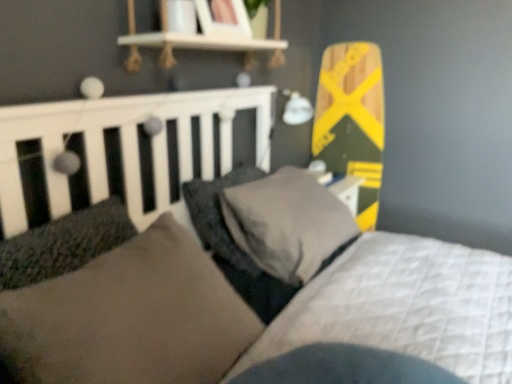
Question: Considering the relative sizes of dark gray plush pillow at center, the second pillow viewed from the back, and suede-like brown pillow at center, the third pillow from the back, in the image provided, is dark gray plush pillow at center, the second pillow viewed from the back, bigger than suede-like brown pillow at center, the third pillow from the back,?

Choices:
 (A) yes
 (B) no

Answer: (B)

Question: Is dark gray plush pillow at center, the second pillow positioned from the front, taller than suede-like brown pillow at center, which is the first pillow in front-to-back order?

Choices:
 (A) no
 (B) yes

Answer: (A)

Question: Is dark gray plush pillow at center, the second pillow viewed from the back, smaller than suede-like brown pillow at center, the third pillow from the back?

Choices:
 (A) yes
 (B) no

Answer: (A)

Question: Is the position of dark gray plush pillow at center, the second pillow viewed from the back, more distant than that of suede-like brown pillow at center, which is the first pillow in front-to-back order?

Choices:
 (A) yes
 (B) no

Answer: (A)

Question: From the image's perspective, is dark gray plush pillow at center, the second pillow positioned from the front, located beneath suede-like brown pillow at center, the third pillow from the back?

Choices:
 (A) no
 (B) yes

Answer: (A)

Question: Does point pos(201,193) appear closer or farther from the camera than point pos(291,168)?

Choices:
 (A) closer
 (B) farther

Answer: (A)

Question: Is dark gray textured pillow at center, placed as the 3th pillow when sorted from front to back, in front of or behind dark gray plush pillow at center, the second pillow viewed from the back, in the image?

Choices:
 (A) front
 (B) behind

Answer: (B)

Question: Is dark gray textured pillow at center, placed as the 3th pillow when sorted from front to back, wider or thinner than dark gray plush pillow at center, the second pillow positioned from the front?

Choices:
 (A) thin
 (B) wide

Answer: (A)

Question: Visually, is dark gray textured pillow at center, placed as the 3th pillow when sorted from front to back, positioned to the left or to the right of dark gray plush pillow at center, the second pillow viewed from the back?

Choices:
 (A) left
 (B) right

Answer: (A)

Question: From the image's perspective, is suede-like brown pillow at center, the third pillow from the back, located above or below dark gray plush pillow at center, the second pillow viewed from the back?

Choices:
 (A) above
 (B) below

Answer: (B)

Question: Is suede-like brown pillow at center, the third pillow from the back, to the left or to the right of dark gray plush pillow at center, the second pillow positioned from the front, in the image?

Choices:
 (A) right
 (B) left

Answer: (B)

Question: Is point (218, 274) positioned closer to the camera than point (315, 233)?

Choices:
 (A) closer
 (B) farther

Answer: (A)

Question: Considering their positions, is suede-like brown pillow at center, the third pillow from the back, located in front of or behind dark gray plush pillow at center, the second pillow viewed from the back?

Choices:
 (A) behind
 (B) front

Answer: (B)

Question: From the image's perspective, relative to dark gray textured pillow at center, placed as the 3th pillow when sorted from front to back, is suede-like brown pillow at center, which is the first pillow in front-to-back order, above or below?

Choices:
 (A) above
 (B) below

Answer: (B)

Question: Do you think suede-like brown pillow at center, the third pillow from the back, is within dark gray textured pillow at center, placed as the 3th pillow when sorted from front to back, or outside of it?

Choices:
 (A) outside
 (B) inside

Answer: (A)